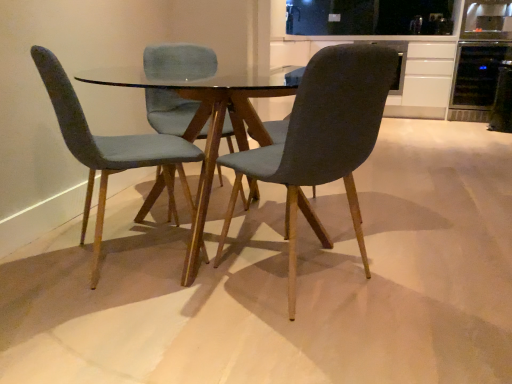
Identify the location of vacant region to the left of dark gray fabric chair at center, which is counted as the second chair, starting from the left. The width and height of the screenshot is (512, 384). (162, 314).